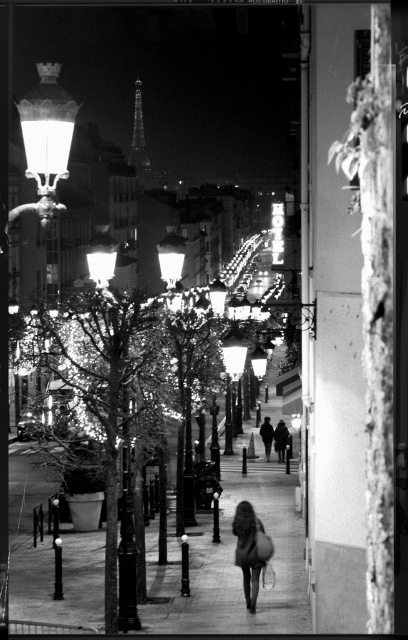
In the scene shown: Is dark fabric bag at center bigger than shiny metallic eiffel tower at upper center?

Incorrect, dark fabric bag at center is not larger than shiny metallic eiffel tower at upper center.

Which is below, dark fabric bag at center or shiny metallic eiffel tower at upper center?

dark fabric bag at center is lower down.

Where is `dark fabric bag at center`? The width and height of the screenshot is (408, 640). dark fabric bag at center is located at coordinates (250, 548).

Who is positioned more to the left, smooth concrete sidewalk at center or shiny metallic eiffel tower at upper center?

Positioned to the left is shiny metallic eiffel tower at upper center.

Is point (281, 593) closer to viewer compared to point (141, 141)?

That is True.

Where is `smooth concrete sidewalk at center`? The width and height of the screenshot is (408, 640). smooth concrete sidewalk at center is located at coordinates (232, 563).

Can you confirm if shiny metal streetlamp at upper left is positioned to the left of dark fabric bag at center?

Correct, you'll find shiny metal streetlamp at upper left to the left of dark fabric bag at center.

Between shiny metal streetlamp at upper left and dark fabric bag at center, which one appears on the right side from the viewer's perspective?

From the viewer's perspective, dark fabric bag at center appears more on the right side.

Who is more distant from viewer, (x=31, y=150) or (x=250, y=604)?

The point (x=250, y=604) is more distant.

Where is `shiny metal streetlamp at upper left`? shiny metal streetlamp at upper left is located at coordinates coord(46,140).